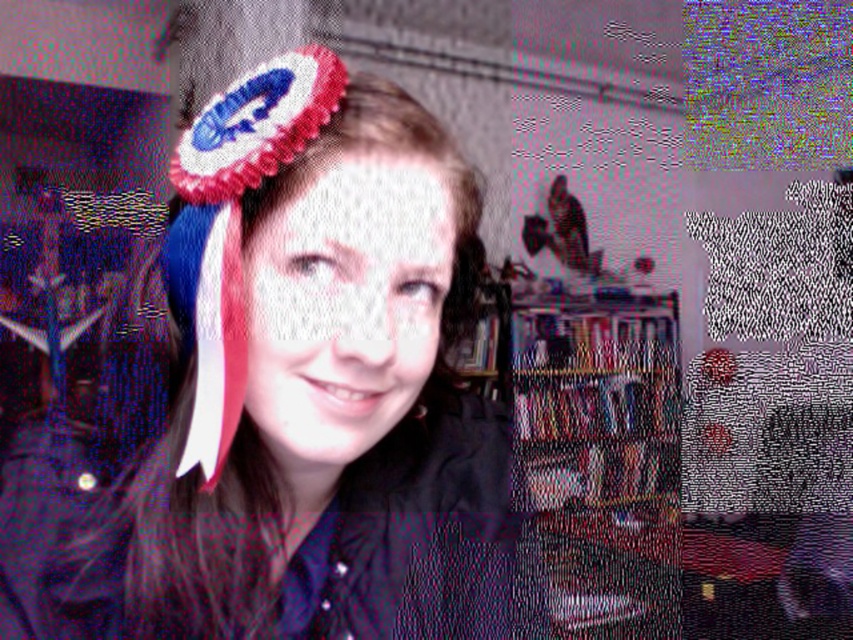
Is the position of fuzzy fabric headband at upper center more distant than that of matte fabric headband at center?

No, it is not.

Between point (363, 593) and point (410, 182), which one is positioned behind?

Positioned behind is point (363, 593).

I want to click on fuzzy fabric headband at upper center, so click(318, 385).

Between fuzzy fabric headband at upper center and wooden bookshelf at center, which one has more height?

wooden bookshelf at center is taller.

Does fuzzy fabric headband at upper center have a smaller size compared to wooden bookshelf at center?

Yes, fuzzy fabric headband at upper center is smaller than wooden bookshelf at center.

Is point (363, 316) behind point (654, 384)?

No, (363, 316) is in front of (654, 384).

The image size is (853, 640). Identify the location of fuzzy fabric headband at upper center. [318, 385].

How distant is matte fabric headband at center from wooden bookshelf at center?

matte fabric headband at center and wooden bookshelf at center are 10.56 feet apart from each other.

From the picture: Does matte fabric headband at center have a greater height compared to wooden bookshelf at center?

Incorrect, matte fabric headband at center's height is not larger of wooden bookshelf at center's.

This screenshot has width=853, height=640. Describe the element at coordinates (346, 301) in the screenshot. I see `matte fabric headband at center` at that location.

Image resolution: width=853 pixels, height=640 pixels. Find the location of `matte fabric headband at center`. matte fabric headband at center is located at coordinates (346, 301).